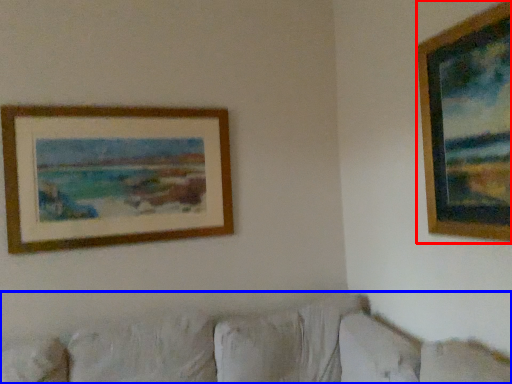
Question: Which object appears farthest to the camera in this image, picture frame (highlighted by a red box) or couch (highlighted by a blue box)?

Choices:
 (A) picture frame
 (B) couch

Answer: (A)